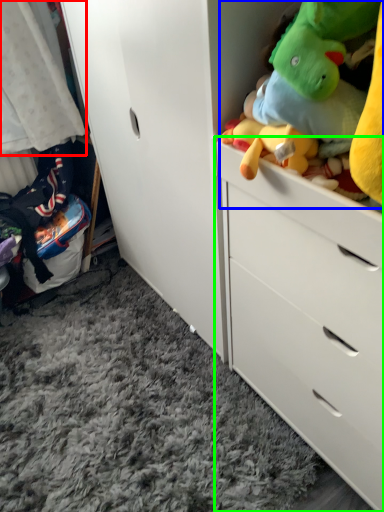
Question: Considering the real-world distances, which object is farthest from baby clothe (highlighted by a red box)? stuff (highlighted by a blue box) or chest of drawers (highlighted by a green box)?

Choices:
 (A) stuff
 (B) chest of drawers

Answer: (A)